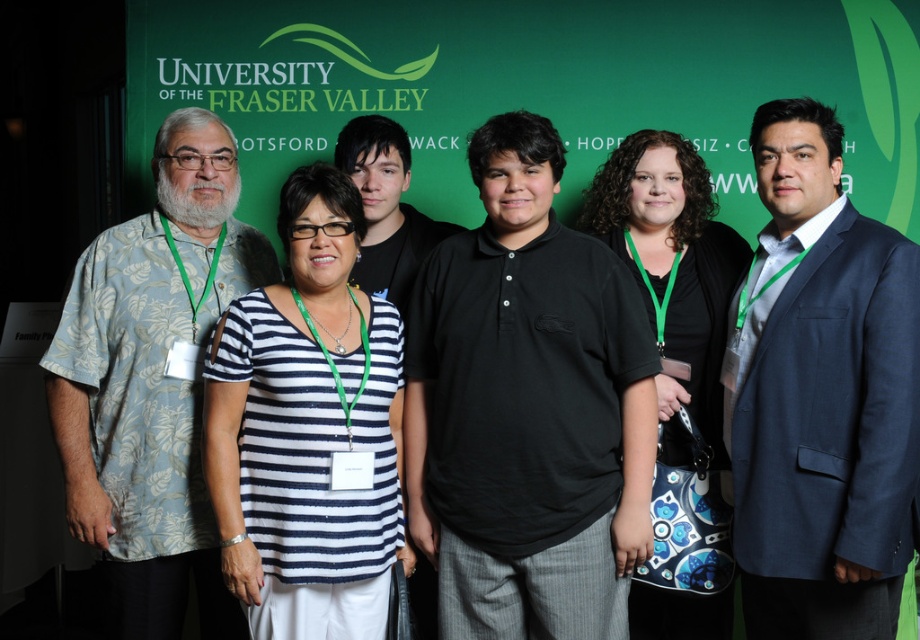
You are organizing a university event and need to arrange name tags for participants. The black cotton polo shirt at center and navy blue suit at center are two attendees. Since you want to place the name tags from left to right according to their positions in the photo, which name tag should you place first?

The black cotton polo shirt at center should be placed first since it is to the left of the navy blue suit at center in the photo.